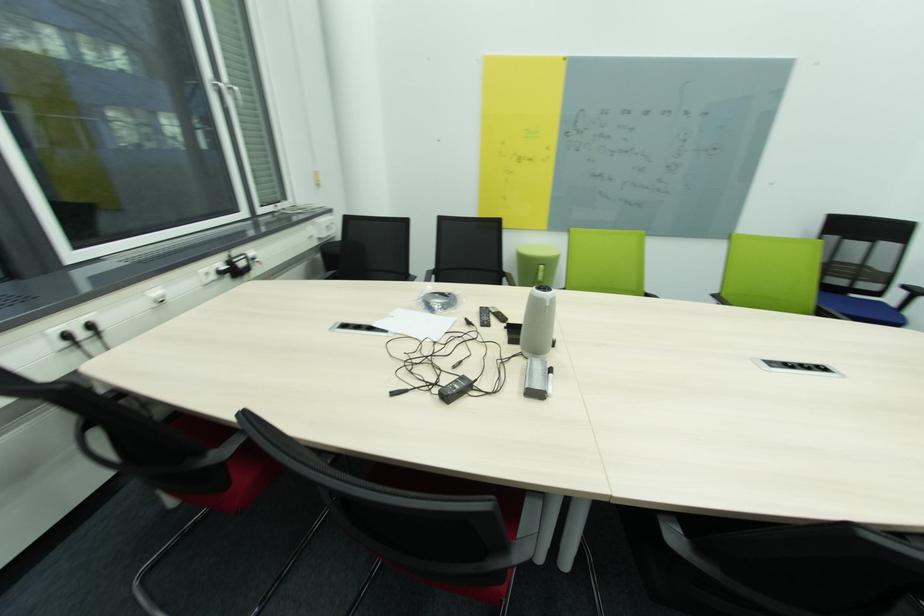
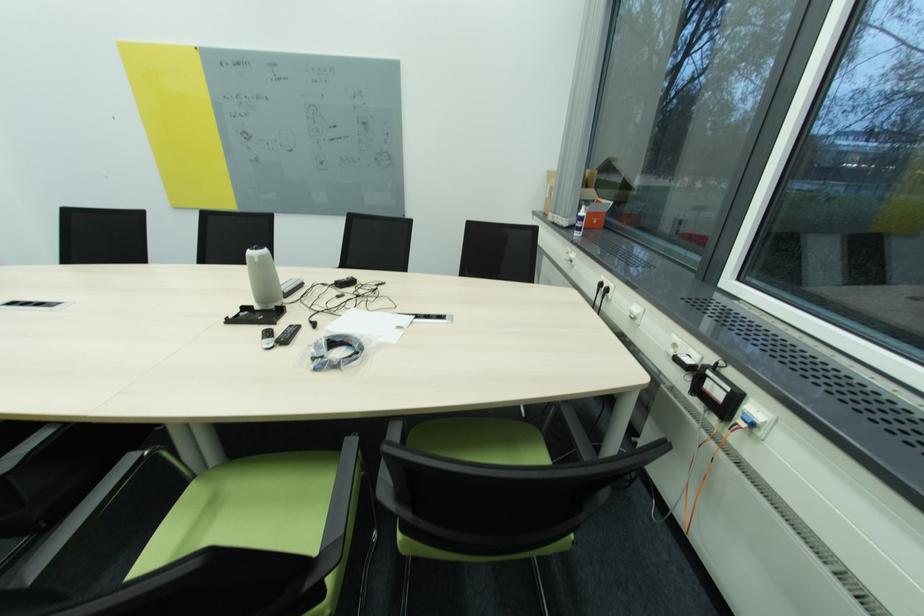
Where in the second image is the point corresponding to [94,328] from the first image?

(612, 291)